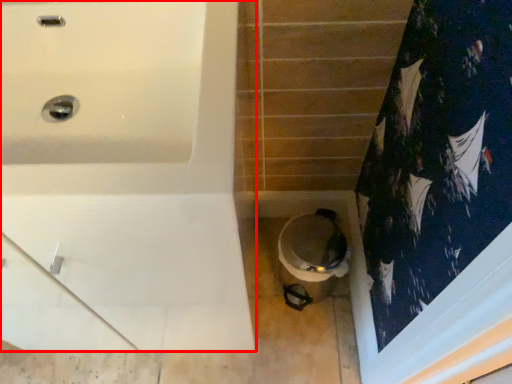
Question: In this image, where is bathtub (annotated by the red box) located relative to toilet?

Choices:
 (A) left
 (B) right

Answer: (A)